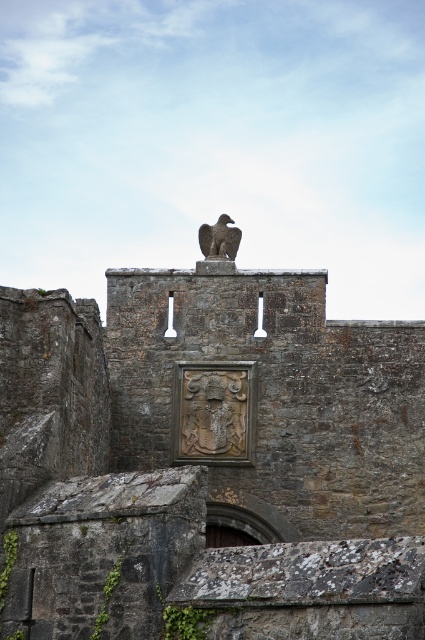
Which is above, stone eagle at center or carved stone shield at center?

Positioned higher is carved stone shield at center.

Does stone eagle at center appear on the right side of carved stone shield at center?

In fact, stone eagle at center is to the left of carved stone shield at center.

Who is more forward, (x=289, y=566) or (x=187, y=442)?

Point (x=289, y=566)

Identify the location of stone eagle at center. The height and width of the screenshot is (640, 425). (209, 464).

Does stone eagle at center appear under rustic stone eagle at center?

Indeed, stone eagle at center is positioned under rustic stone eagle at center.

Can you confirm if stone eagle at center is taller than rustic stone eagle at center?

Correct, stone eagle at center is much taller as rustic stone eagle at center.

Is point (172, 280) closer to viewer compared to point (221, 227)?

Yes, it is in front of point (221, 227).

Image resolution: width=425 pixels, height=640 pixels. Identify the location of stone eagle at center. (209, 464).

Is carved stone shield at center positioned before rustic stone eagle at center?

Yes.

Is carved stone shield at center to the left of rustic stone eagle at center from the viewer's perspective?

Incorrect, carved stone shield at center is not on the left side of rustic stone eagle at center.

Is point (221, 413) more distant than point (212, 250)?

No, (221, 413) is in front of (212, 250).

Locate an element on the screen. The width and height of the screenshot is (425, 640). carved stone shield at center is located at coordinates (214, 412).